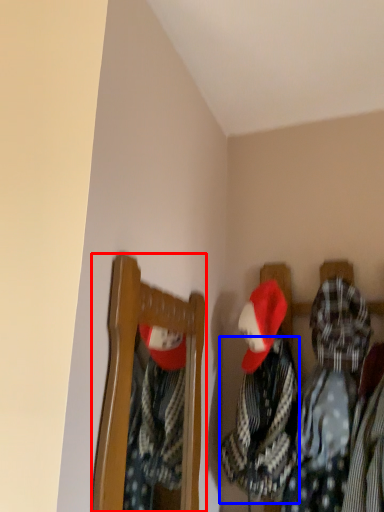
Question: Among these objects, which one is nearest to the camera, furniture (highlighted by a red box) or clothing (highlighted by a blue box)?

Choices:
 (A) furniture
 (B) clothing

Answer: (A)